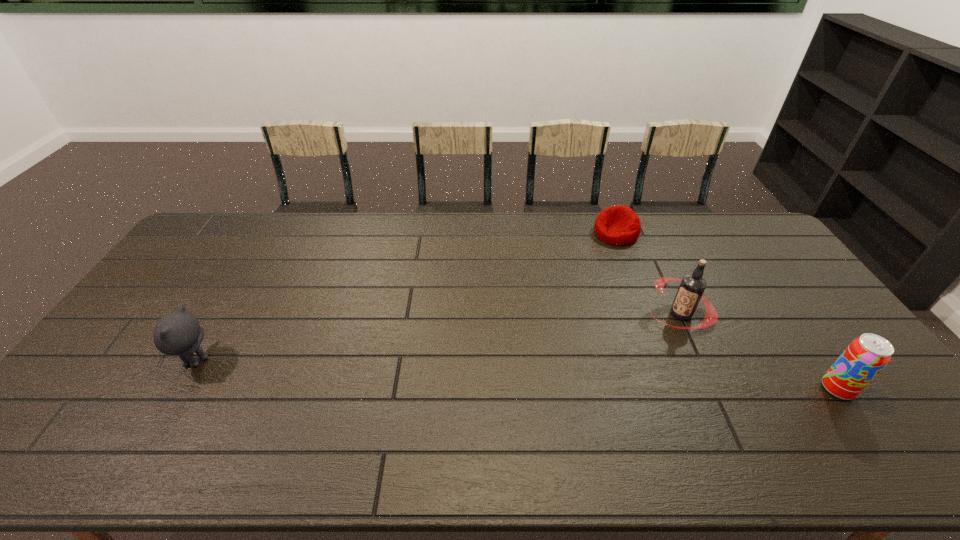
Find the location of a particular element. This screenshot has width=960, height=540. the leftmost object is located at coordinates (179, 333).

Where is `soda can`? This screenshot has width=960, height=540. soda can is located at coordinates (865, 357).

Where is `the third nearest object`? This screenshot has height=540, width=960. the third nearest object is located at coordinates (692, 286).

Find the location of `the farthest object`. the farthest object is located at coordinates pyautogui.click(x=619, y=225).

Where is `beanbag`? The height and width of the screenshot is (540, 960). beanbag is located at coordinates (619, 225).

This screenshot has width=960, height=540. Find the location of `vacant space located on the front-facing side of the leftmost object`. vacant space located on the front-facing side of the leftmost object is located at coordinates (145, 360).

Find the location of a particular element. The width and height of the screenshot is (960, 540). free space located 0.180m on the front-facing side of the leftmost object is located at coordinates (112, 360).

Identify the location of free point located 0.110m on the front-facing side of the leftmost object. The height and width of the screenshot is (540, 960). (137, 360).

Where is `vacant point located on the back of the soda can`? Image resolution: width=960 pixels, height=540 pixels. vacant point located on the back of the soda can is located at coordinates (771, 294).

The image size is (960, 540). I want to click on vacant space located on the label of the root beer, so click(x=612, y=357).